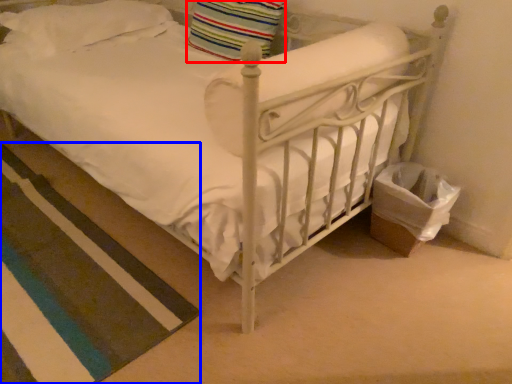
Question: Which of the following is the closest to the observer, pillow (highlighted by a red box) or strip (highlighted by a blue box)?

Choices:
 (A) pillow
 (B) strip

Answer: (B)